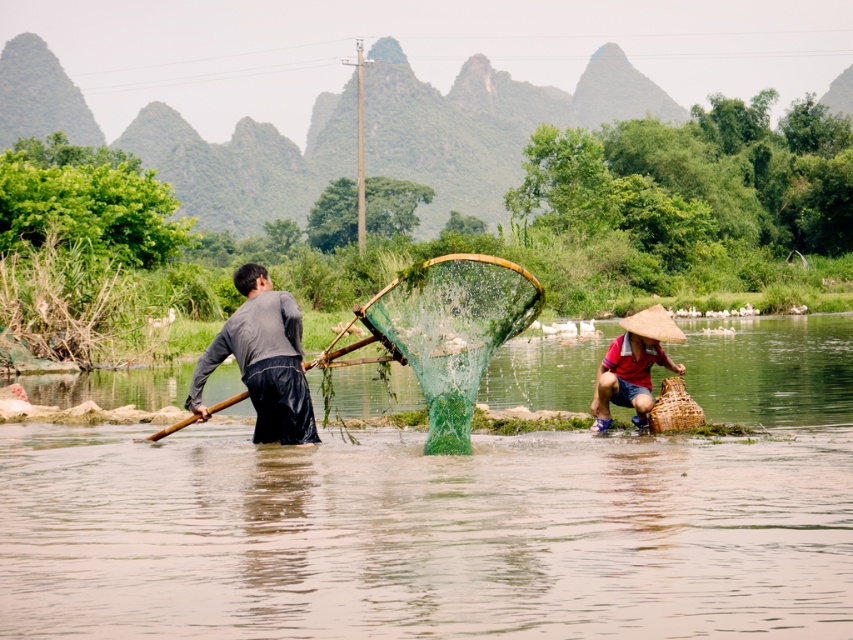
Describe the element at coordinates (451, 332) in the screenshot. I see `green mesh fishing net at center` at that location.

Is green mesh fishing net at center to the right of matte brown straw hat at lower right from the viewer's perspective?

No, green mesh fishing net at center is not to the right of matte brown straw hat at lower right.

Is point (424, 269) more distant than point (637, 384)?

No, it is in front of (637, 384).

Where is `green mesh fishing net at center`? Image resolution: width=853 pixels, height=640 pixels. green mesh fishing net at center is located at coordinates (451, 332).

Does green mesh net at center appear on the right side of dark gray fabric shirt at center?

Yes, green mesh net at center is to the right of dark gray fabric shirt at center.

Between green mesh net at center and dark gray fabric shirt at center, which one has less height?

green mesh net at center is shorter.

Identify the location of green mesh net at center. This screenshot has height=640, width=853. (454, 520).

Which is above, green mesh net at center or matte brown straw hat at lower right?

matte brown straw hat at lower right

Locate an element on the screen. green mesh net at center is located at coordinates (454, 520).